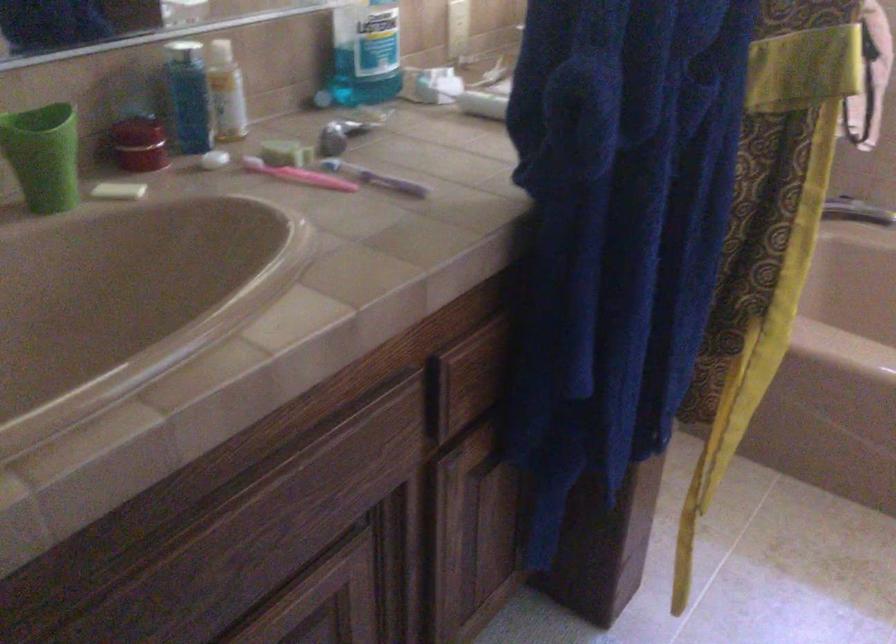
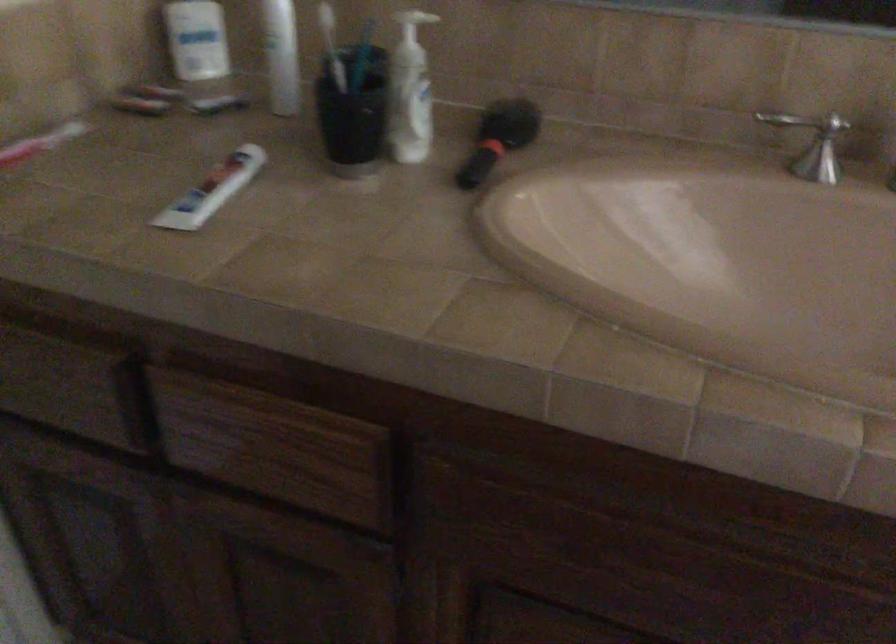
How did the camera likely rotate?

The rotation direction of the camera is left-down.